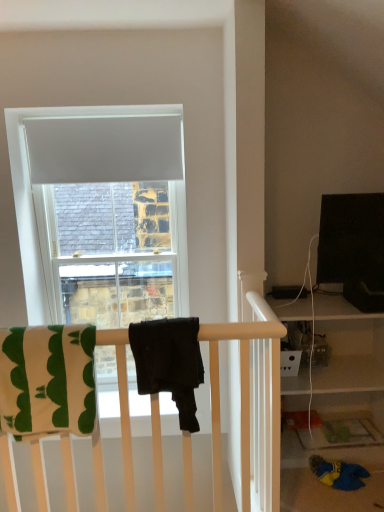
Question: Should I look upward or downward to see white matte curtain at upper center?

Choices:
 (A) down
 (B) up

Answer: (B)

Question: Is green cotton beach towel at left, placed as the first beach towel when sorted from left to right, smaller than black matte towel at center, the 2th beach towel when ordered from left to right?

Choices:
 (A) no
 (B) yes

Answer: (A)

Question: From a real-world perspective, does green cotton beach towel at left, placed as the first beach towel when sorted from left to right, stand above black matte towel at center, the 1th beach towel in the right-to-left sequence?

Choices:
 (A) no
 (B) yes

Answer: (A)

Question: From a real-world perspective, is green cotton beach towel at left, the second beach towel when ordered from right to left, below black matte towel at center, the 2th beach towel when ordered from left to right?

Choices:
 (A) no
 (B) yes

Answer: (B)

Question: Considering the relative sizes of green cotton beach towel at left, placed as the first beach towel when sorted from left to right, and black matte towel at center, the 2th beach towel when ordered from left to right, in the image provided, is green cotton beach towel at left, placed as the first beach towel when sorted from left to right, wider than black matte towel at center, the 2th beach towel when ordered from left to right,?

Choices:
 (A) no
 (B) yes

Answer: (A)

Question: Can we say green cotton beach towel at left, placed as the first beach towel when sorted from left to right, lies outside black matte towel at center, the 1th beach towel in the right-to-left sequence?

Choices:
 (A) no
 (B) yes

Answer: (B)

Question: Is green cotton beach towel at left, placed as the first beach towel when sorted from left to right, bigger than black matte towel at center, the 2th beach towel when ordered from left to right?

Choices:
 (A) yes
 (B) no

Answer: (A)

Question: From a real-world perspective, is white matte curtain at upper center physically below green cotton beach towel at left, placed as the first beach towel when sorted from left to right?

Choices:
 (A) no
 (B) yes

Answer: (A)

Question: Can you confirm if white matte curtain at upper center is positioned to the right of green cotton beach towel at left, the second beach towel when ordered from right to left?

Choices:
 (A) no
 (B) yes

Answer: (B)

Question: Is white matte curtain at upper center outside of green cotton beach towel at left, placed as the first beach towel when sorted from left to right?

Choices:
 (A) yes
 (B) no

Answer: (A)

Question: Is white matte curtain at upper center positioned behind green cotton beach towel at left, placed as the first beach towel when sorted from left to right?

Choices:
 (A) no
 (B) yes

Answer: (B)

Question: Is white matte curtain at upper center thinner than green cotton beach towel at left, placed as the first beach towel when sorted from left to right?

Choices:
 (A) no
 (B) yes

Answer: (B)

Question: Would you consider white matte curtain at upper center to be distant from green cotton beach towel at left, placed as the first beach towel when sorted from left to right?

Choices:
 (A) no
 (B) yes

Answer: (B)

Question: From a real-world perspective, does black matte towel at center, the 1th beach towel in the right-to-left sequence, sit lower than white matte curtain at upper center?

Choices:
 (A) yes
 (B) no

Answer: (A)